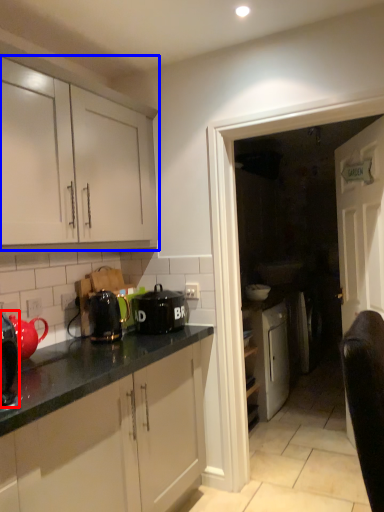
Question: Which object is further to the camera taking this photo, kitchen appliance (highlighted by a red box) or cabinetry (highlighted by a blue box)?

Choices:
 (A) kitchen appliance
 (B) cabinetry

Answer: (B)